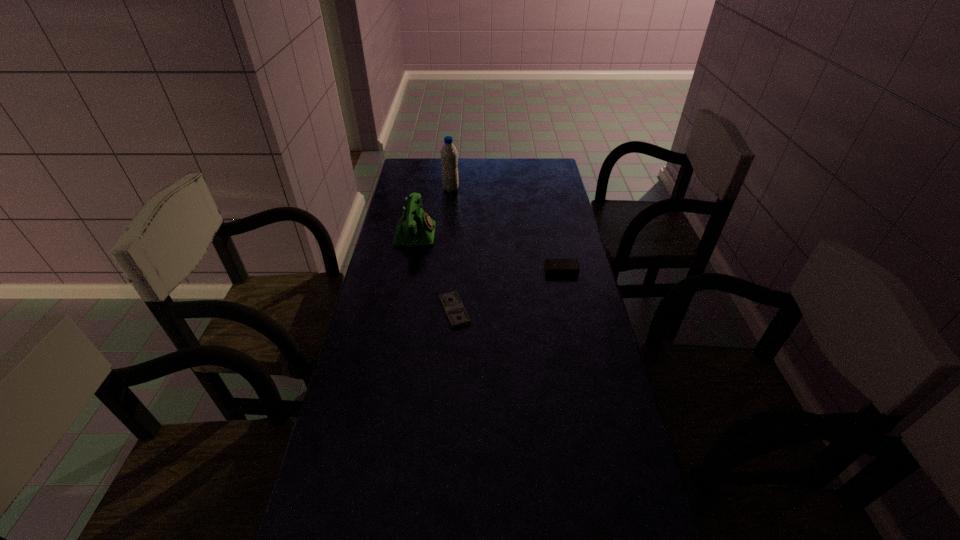
Image resolution: width=960 pixels, height=540 pixels. I want to click on the tallest object, so click(449, 157).

I want to click on water bottle, so click(x=449, y=157).

This screenshot has height=540, width=960. I want to click on the third shortest object, so click(415, 228).

The width and height of the screenshot is (960, 540). Identify the location of the second farthest object. (415, 228).

Identify the location of the rightmost object. This screenshot has height=540, width=960. (553, 266).

Find the location of a particular element. The width and height of the screenshot is (960, 540). the third tallest object is located at coordinates (553, 266).

Locate an element on the screen. Image resolution: width=960 pixels, height=540 pixels. the nearest object is located at coordinates (451, 302).

In order to click on the shortest object in this screenshot , I will do `click(451, 302)`.

At what (x,y) coordinates should I click in order to perform the action: click on vacant position located 0.160m on the left of the tallest object. Please return your answer as a coordinate pair (x, y). This screenshot has height=540, width=960. Looking at the image, I should click on (406, 189).

Identify the location of vacant space located on the dial of the third shortest object. This screenshot has width=960, height=540. (488, 234).